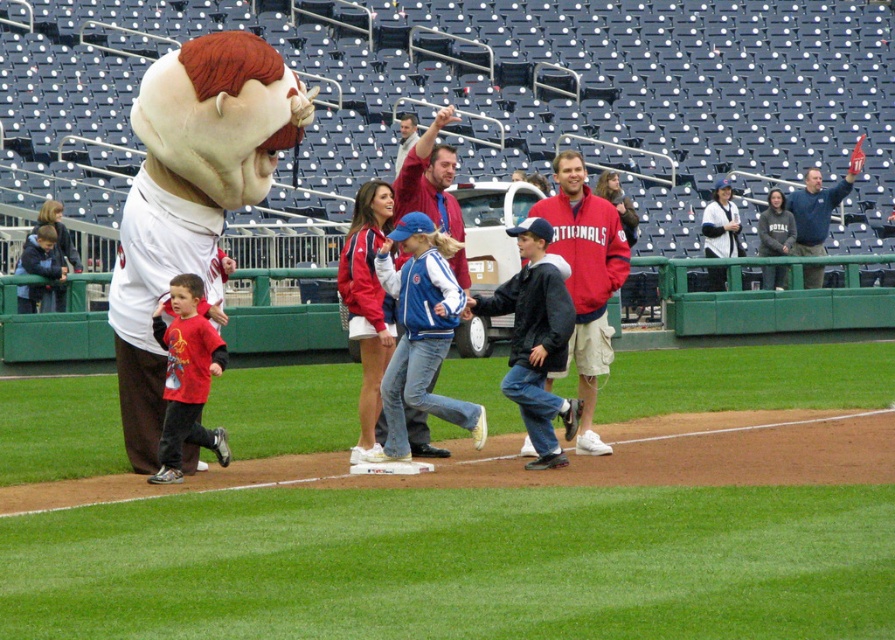
You are a photographer at the baseball stadium and want to capture a photo of the mascot and the crowd. The red matte shirt at left and dark gray hoodie at upper right are in your frame. If you want to ensure both are visible in the photo, which clothing item should you focus on to avoid cropping either?

You should focus on the dark gray hoodie at upper right because it is wider than the red matte shirt at left, ensuring both fit within the frame.